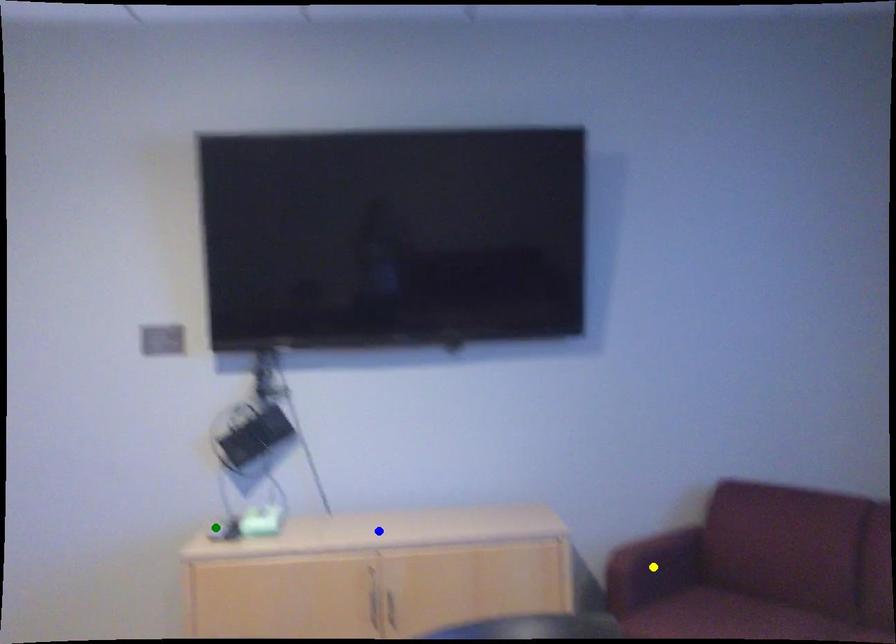
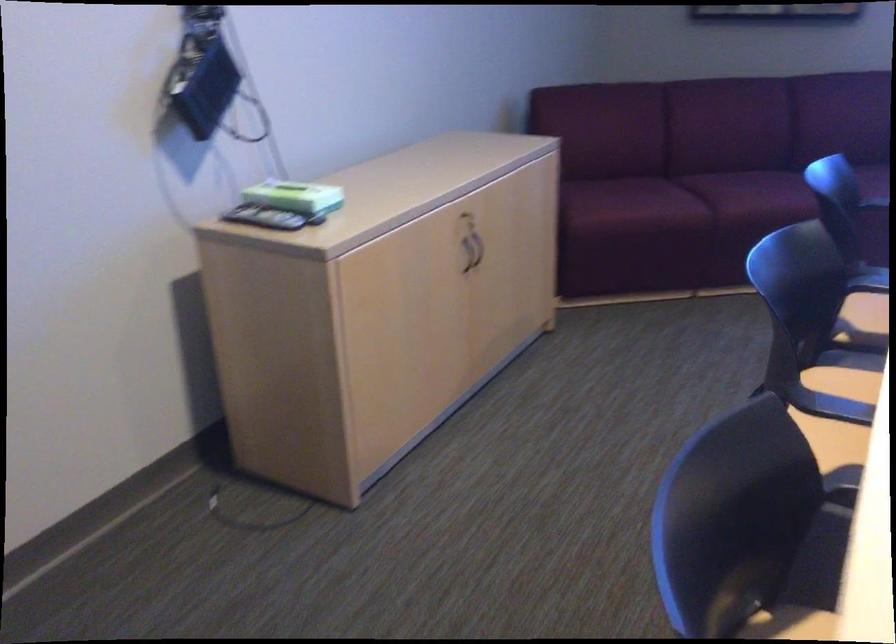
I am providing you with two images of the same scene from different viewpoints. Three points are marked in image1. Which point corresponds to a part or object that is occluded in image2?In image1, three points are marked. Which of them correspond to a part or object that is occluded in image2?Among the three points shown in image1, which one corresponds to a part or object that is no longer visible due to occlusion in image2?

yellow point